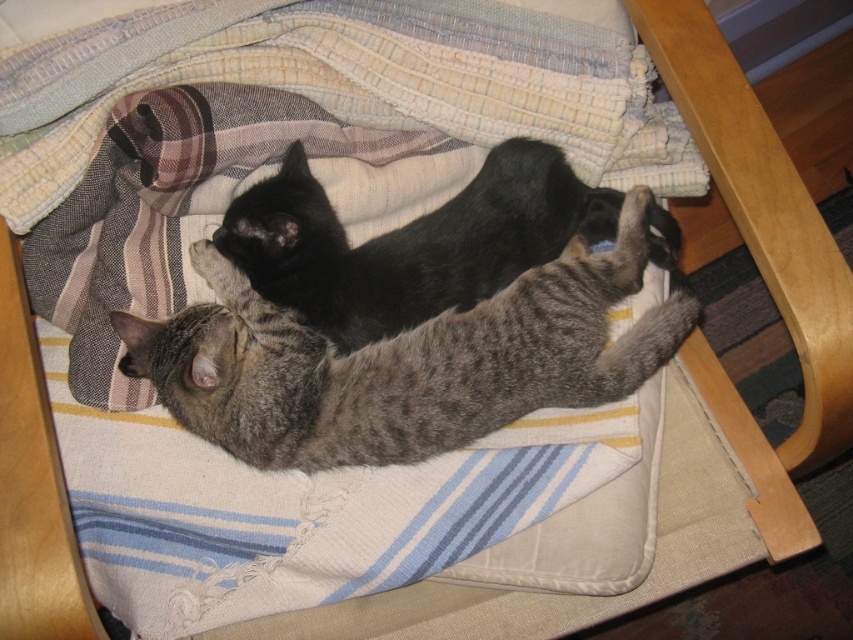
Is point (582, 364) positioned after point (656, 205)?

No, (582, 364) is in front of (656, 205).

Does gray striped cat at center have a lesser width compared to black fur cat at upper center?

Incorrect, gray striped cat at center's width is not less than black fur cat at upper center's.

The image size is (853, 640). Identify the location of gray striped cat at center. (405, 358).